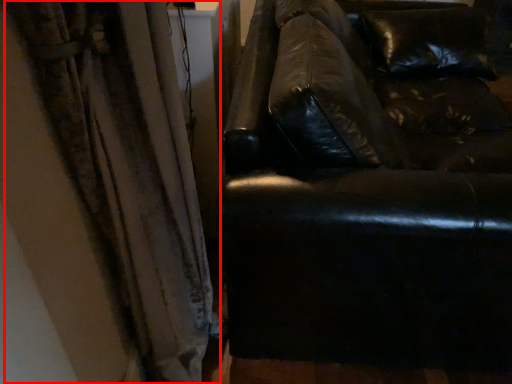
Question: Considering the relative positions of curtain (annotated by the red box) and studio couch in the image provided, where is curtain (annotated by the red box) located with respect to the staircase?

Choices:
 (A) right
 (B) left

Answer: (B)